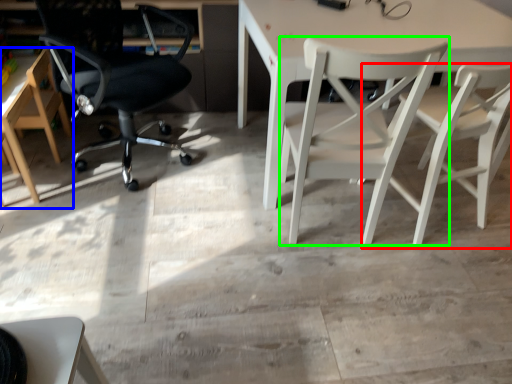
Question: Which object is positioned farthest from chair (highlighted by a red box)? Select from chair (highlighted by a blue box) and chair (highlighted by a green box).

Choices:
 (A) chair
 (B) chair

Answer: (A)